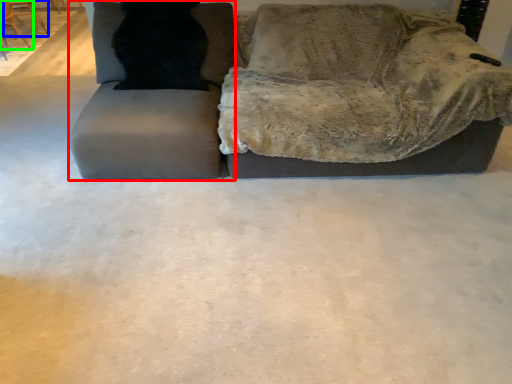
Question: Which object is positioned closest to swivel chair (highlighted by a red box)? Select from chair (highlighted by a blue box) and chair (highlighted by a green box).

Choices:
 (A) chair
 (B) chair

Answer: (B)